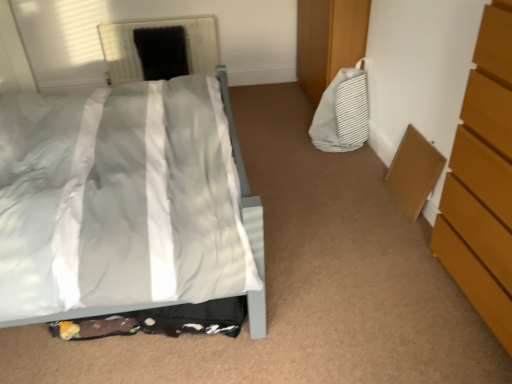
You are a GUI agent. You are given a task and a screenshot of the screen. Output one action in this format:
    pyautogui.click(x=<x>, y=<y>)
    Task: Click on the wooden chest of drawers at right
    
    Given the screenshot: What is the action you would take?
    pyautogui.click(x=483, y=181)

Find the location of a particular element. Image resolution: width=512 pixels, height=384 pixels. white striped fabric bag at right is located at coordinates (342, 112).

Is there a large distance between black matte screen door at upper center and white glossy bed at center?

Indeed, black matte screen door at upper center is not near white glossy bed at center.

Which of these two, black matte screen door at upper center or white glossy bed at center, is wider?

With larger width is white glossy bed at center.

Considering the relative sizes of black matte screen door at upper center and white glossy bed at center in the image provided, is black matte screen door at upper center bigger than white glossy bed at center?

Incorrect, black matte screen door at upper center is not larger than white glossy bed at center.

Locate an element on the screen. The image size is (512, 384). screen door that is above the white glossy bed at center (from the image's perspective) is located at coordinates (162, 52).

Is wooden chest of drawers at right to the right of black matte screen door at upper center from the viewer's perspective?

Yes, wooden chest of drawers at right is to the right of black matte screen door at upper center.

Between wooden chest of drawers at right and black matte screen door at upper center, which one has larger size?

wooden chest of drawers at right is bigger.

Are wooden chest of drawers at right and black matte screen door at upper center located far from each other?

Yes, wooden chest of drawers at right is far from black matte screen door at upper center.

Can you confirm if wooden chest of drawers at right is taller than black matte screen door at upper center?

Indeed, wooden chest of drawers at right has a greater height compared to black matte screen door at upper center.

Considering the sizes of objects wooden chest of drawers at right and white striped fabric bag at right in the image provided, who is wider, wooden chest of drawers at right or white striped fabric bag at right?

wooden chest of drawers at right is wider.

Between point (487, 309) and point (366, 97), which one is positioned behind?

The point (366, 97) is behind.

Could you tell me if wooden chest of drawers at right is turned towards white striped fabric bag at right?

No, wooden chest of drawers at right is not facing towards white striped fabric bag at right.

Considering the relative positions of white striped fabric bag at right and black matte screen door at upper center in the image provided, is white striped fabric bag at right to the left of black matte screen door at upper center from the viewer's perspective?

Incorrect, white striped fabric bag at right is not on the left side of black matte screen door at upper center.

Could you tell me if white striped fabric bag at right is turned towards black matte screen door at upper center?

No.

Where is `material that is under the black matte screen door at upper center (from a real-world perspective)`? The image size is (512, 384). material that is under the black matte screen door at upper center (from a real-world perspective) is located at coordinates (342, 112).

Is white striped fabric bag at right next to black matte screen door at upper center?

No, white striped fabric bag at right is not touching black matte screen door at upper center.

Is white glossy bed at center positioned before wooden chest of drawers at right?

No.

Which of these two, white glossy bed at center or wooden chest of drawers at right, stands taller?

wooden chest of drawers at right is taller.

From the image's perspective, is white glossy bed at center above or below wooden chest of drawers at right?

From the image's perspective, white glossy bed at center appears above wooden chest of drawers at right.

Which is behind, point (262, 222) or point (500, 5)?

Point (262, 222)

How far apart are white striped fabric bag at right and white glossy bed at center?

white striped fabric bag at right and white glossy bed at center are 3.37 feet apart from each other.

Considering the sizes of objects white striped fabric bag at right and white glossy bed at center in the image provided, who is wider, white striped fabric bag at right or white glossy bed at center?

Wider between the two is white glossy bed at center.

Is white striped fabric bag at right oriented away from white glossy bed at center?

No, white glossy bed at center is not at the back of white striped fabric bag at right.

Which object is positioned more to the right, white striped fabric bag at right or white glossy bed at center?

white striped fabric bag at right is more to the right.

Is the position of wooden chest of drawers at right less distant than that of white glossy bed at center?

Yes, wooden chest of drawers at right is closer to the camera.

Looking at this image, from the image's perspective, is wooden chest of drawers at right positioned above or below white glossy bed at center?

From the image's perspective, wooden chest of drawers at right appears below white glossy bed at center.

Does wooden chest of drawers at right have a smaller size compared to white glossy bed at center?

Yes, wooden chest of drawers at right is smaller than white glossy bed at center.

This screenshot has height=384, width=512. What are the coordinates of `screen door above the white glossy bed at center (from the image's perspective)` in the screenshot? It's located at (162, 52).

In the image, there is a wooden chest of drawers at right. In order to click on screen door below it (from a real-world perspective) in this screenshot , I will do click(x=162, y=52).

Estimate the real-world distances between objects in this image. Which object is closer to white striped fabric bag at right, black matte screen door at upper center or wooden chest of drawers at right?

The object closer to white striped fabric bag at right is wooden chest of drawers at right.

Based on their spatial positions, is white glossy bed at center or black matte screen door at upper center closer to white striped fabric bag at right?

white glossy bed at center.

Estimate the real-world distances between objects in this image. Which object is further from black matte screen door at upper center, white glossy bed at center or white striped fabric bag at right?

white glossy bed at center lies further to black matte screen door at upper center than the other object.

From the image, which object appears to be farther from black matte screen door at upper center, wooden chest of drawers at right or white striped fabric bag at right?

Among the two, wooden chest of drawers at right is located further to black matte screen door at upper center.

Looking at this image, from the image, which object appears to be farther from wooden chest of drawers at right, black matte screen door at upper center or white glossy bed at center?

black matte screen door at upper center.

When comparing their distances from white glossy bed at center, does black matte screen door at upper center or wooden chest of drawers at right seem closer?

wooden chest of drawers at right is positioned closer to the anchor white glossy bed at center.

From the image, which object appears to be farther from black matte screen door at upper center, white striped fabric bag at right or white glossy bed at center?

white glossy bed at center is further to black matte screen door at upper center.

Looking at the image, which one is located closer to white glossy bed at center, black matte screen door at upper center or white striped fabric bag at right?

The object closer to white glossy bed at center is white striped fabric bag at right.

The width and height of the screenshot is (512, 384). In order to click on bed between wooden chest of drawers at right and black matte screen door at upper center in the front-back direction in this screenshot , I will do `click(244, 182)`.

Image resolution: width=512 pixels, height=384 pixels. Identify the location of material between wooden chest of drawers at right and black matte screen door at upper center in the front-back direction. (342, 112).

You are a GUI agent. You are given a task and a screenshot of the screen. Output one action in this format:
    pyautogui.click(x=<x>, y=<y>)
    Task: Click on the bed located between wooden chest of drawers at right and white striped fabric bag at right in the depth direction
    The width and height of the screenshot is (512, 384).
    Given the screenshot: What is the action you would take?
    pyautogui.click(x=244, y=182)

The height and width of the screenshot is (384, 512). Find the location of `material between white glossy bed at center and black matte screen door at upper center along the z-axis`. material between white glossy bed at center and black matte screen door at upper center along the z-axis is located at coordinates (342, 112).